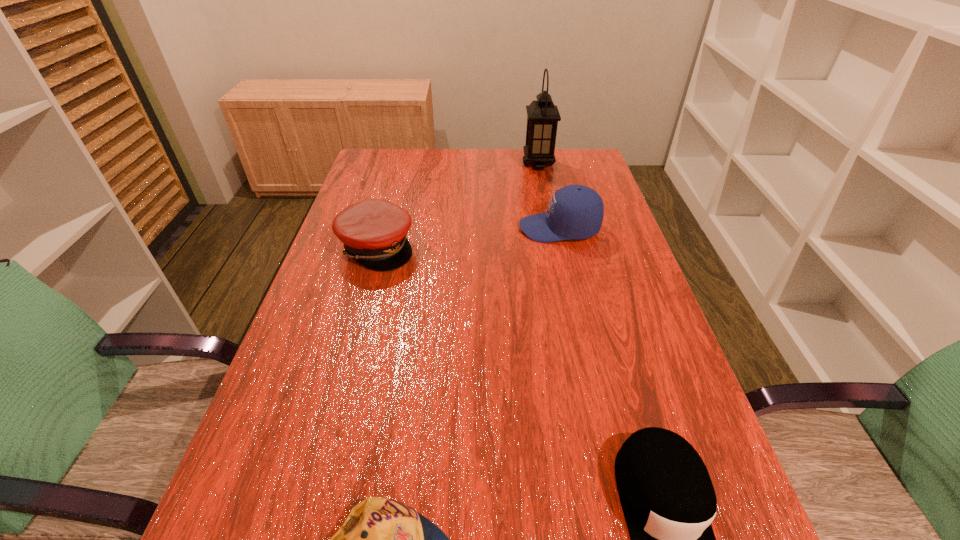
The width and height of the screenshot is (960, 540). In order to click on the farthest object in this screenshot , I will do `click(542, 115)`.

The height and width of the screenshot is (540, 960). I want to click on lantern, so click(x=542, y=115).

This screenshot has width=960, height=540. What are the coordinates of `the second tallest object` in the screenshot? It's located at (x=576, y=212).

What are the coordinates of `vacant space located 0.220m on the left of the lantern` in the screenshot? It's located at (457, 164).

Find the location of a particular element. The height and width of the screenshot is (540, 960). vacant area located 0.390m on the front-facing side of the tallest cap is located at coordinates click(x=377, y=228).

The image size is (960, 540). What are the coordinates of `free location located 0.230m on the front-facing side of the tallest cap` in the screenshot? It's located at (436, 228).

Identify the location of vacant area situated on the front-facing side of the tallest cap. Image resolution: width=960 pixels, height=540 pixels. (472, 228).

The height and width of the screenshot is (540, 960). I want to click on object that is at the far edge, so click(542, 115).

The image size is (960, 540). In order to click on object that is at the left edge in this screenshot , I will do pyautogui.click(x=373, y=231).

Find the location of a particular element. lantern positioned at the right edge is located at coordinates (542, 115).